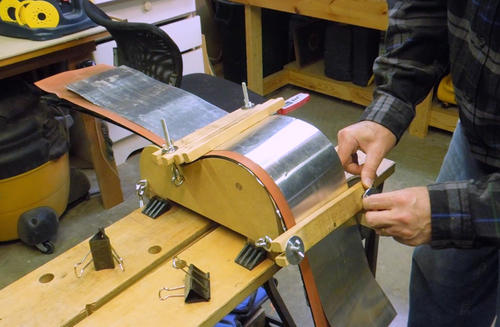
Locate an element on the screen. wood holders is located at coordinates (226, 126), (212, 127), (329, 219).